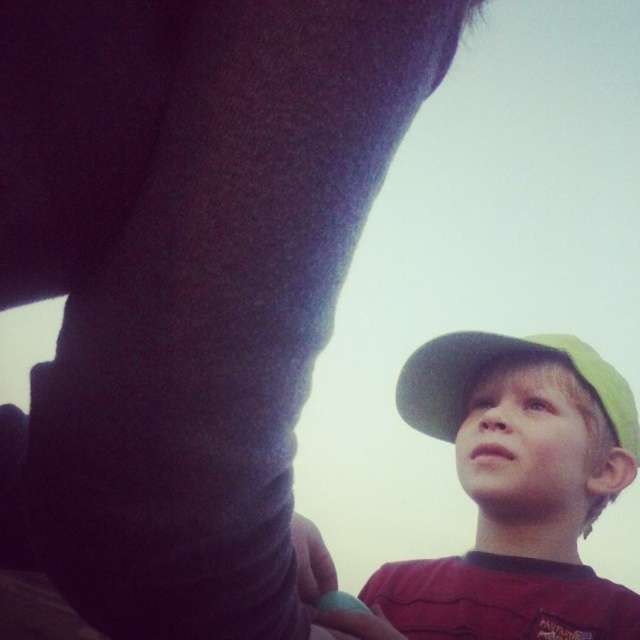
What do you see at coordinates (516, 488) in the screenshot? I see `matte green cap at lower right` at bounding box center [516, 488].

Is point (520, 451) closer to viewer compared to point (461, 365)?

Yes, point (520, 451) is in front of point (461, 365).

This screenshot has height=640, width=640. Find the location of `matte green cap at lower right`. matte green cap at lower right is located at coordinates (516, 488).